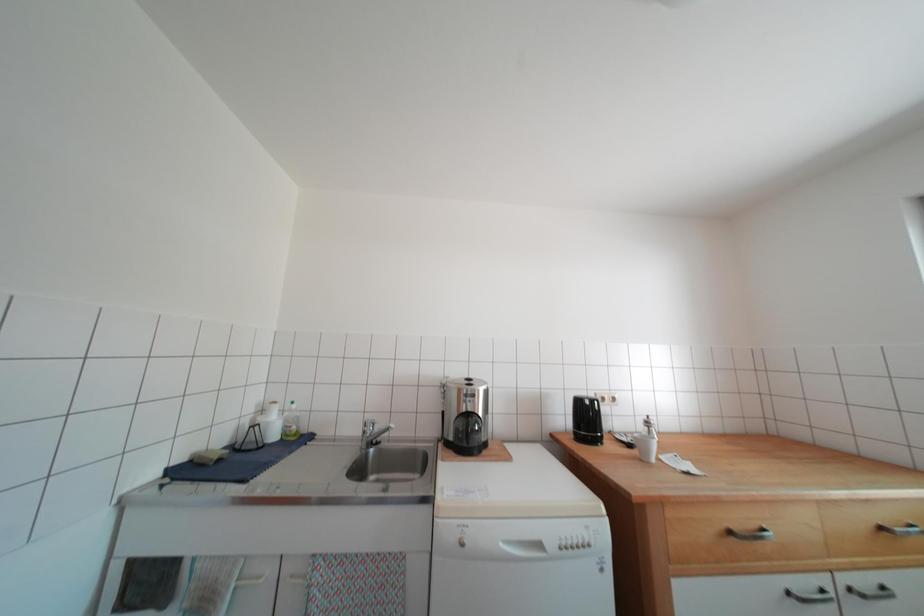
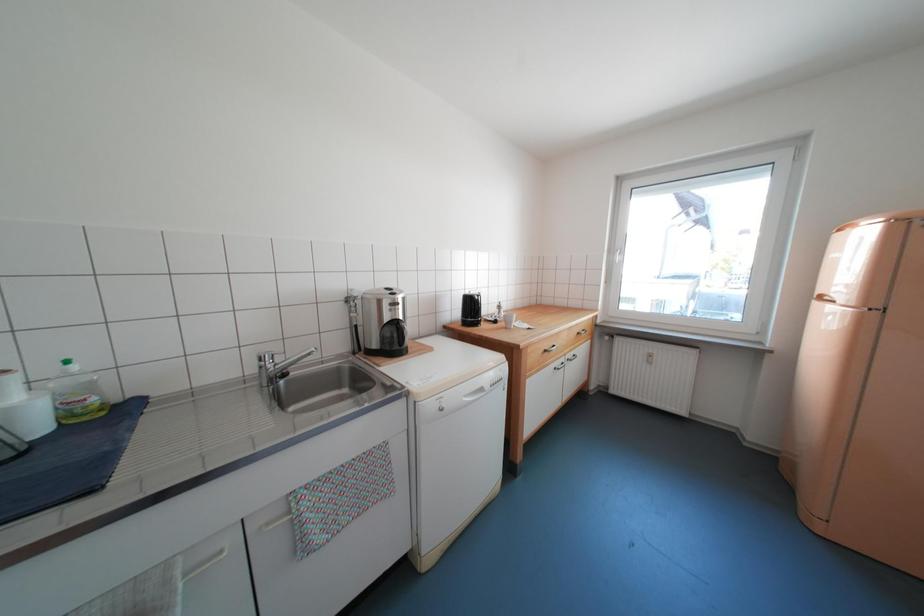
How did the camera likely rotate?

The camera's rotation is toward right-down.